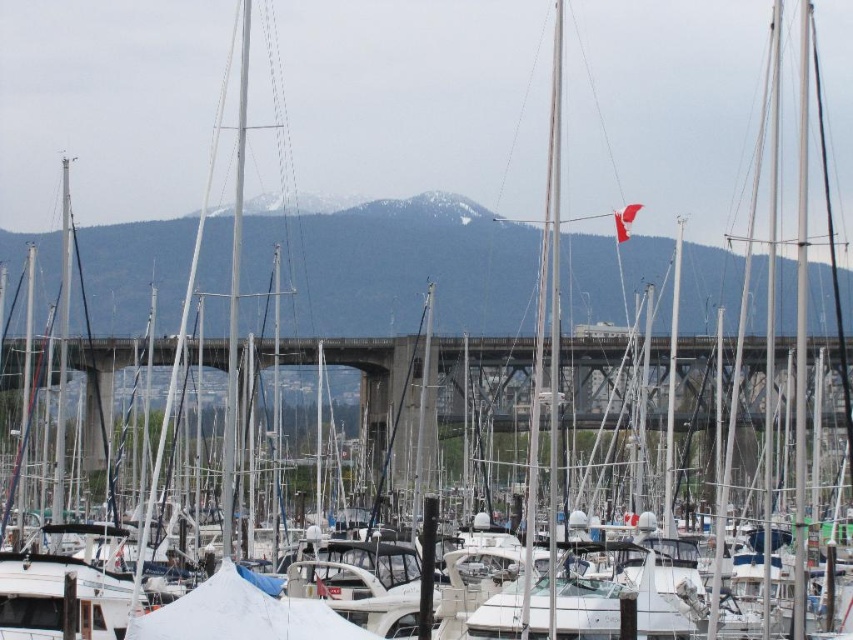
Question: Which object is closer to the camera taking this photo?

Choices:
 (A) snowy mountain at upper center
 (B) concrete bridge at center

Answer: (B)

Question: Which point is farther to the camera?

Choices:
 (A) snowy mountain at upper center
 (B) concrete bridge at center

Answer: (A)

Question: Can you confirm if snowy mountain at upper center is thinner than concrete bridge at center?

Choices:
 (A) no
 (B) yes

Answer: (A)

Question: Is snowy mountain at upper center thinner than concrete bridge at center?

Choices:
 (A) no
 (B) yes

Answer: (A)

Question: Is snowy mountain at upper center thinner than concrete bridge at center?

Choices:
 (A) yes
 (B) no

Answer: (B)